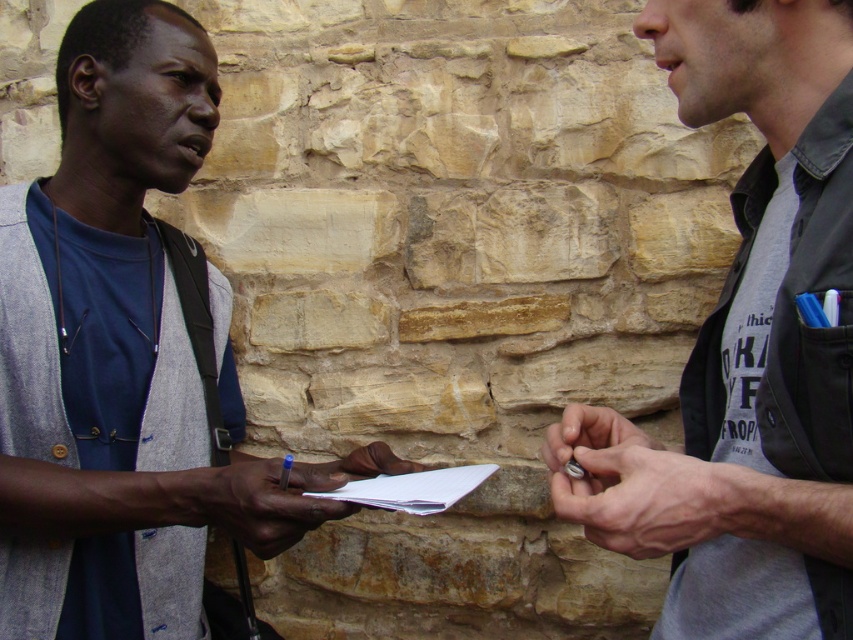
Who is positioned more to the left, gray fabric shirt at right or white paper at center?

From the viewer's perspective, white paper at center appears more on the left side.

Where is `gray fabric shirt at right`? The image size is (853, 640). gray fabric shirt at right is located at coordinates (747, 348).

This screenshot has height=640, width=853. I want to click on gray fabric shirt at right, so click(747, 348).

Is gray fabric shirt at right above smooth paper at center?

Yes, gray fabric shirt at right is above smooth paper at center.

Which is above, gray fabric shirt at right or smooth paper at center?

gray fabric shirt at right is higher up.

Locate an element on the screen. gray fabric shirt at right is located at coordinates (747, 348).

Is matte gray vest at left taller than gray fabric shirt at right?

Yes, matte gray vest at left is taller than gray fabric shirt at right.

Can you confirm if matte gray vest at left is thinner than gray fabric shirt at right?

In fact, matte gray vest at left might be wider than gray fabric shirt at right.

Identify the location of matte gray vest at left. This screenshot has width=853, height=640. (120, 356).